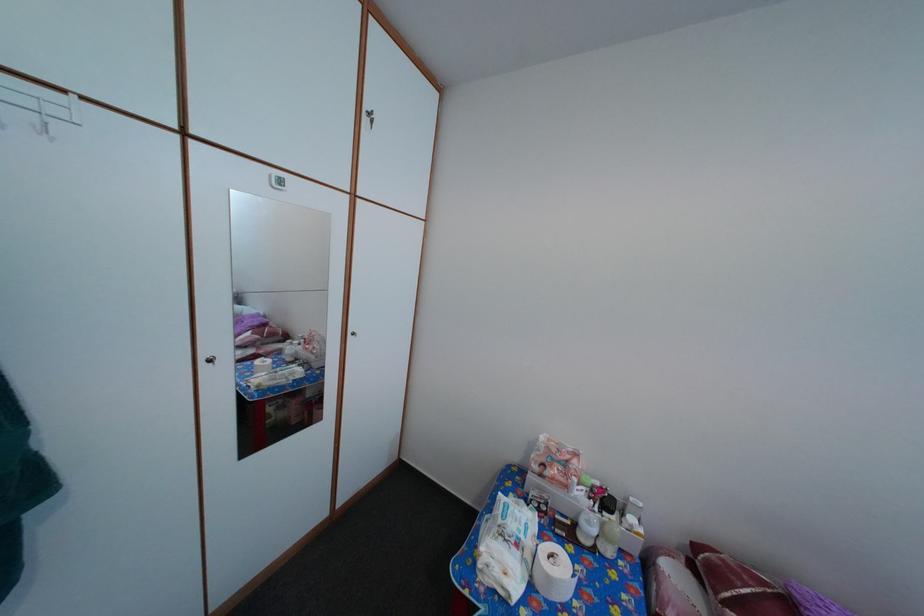
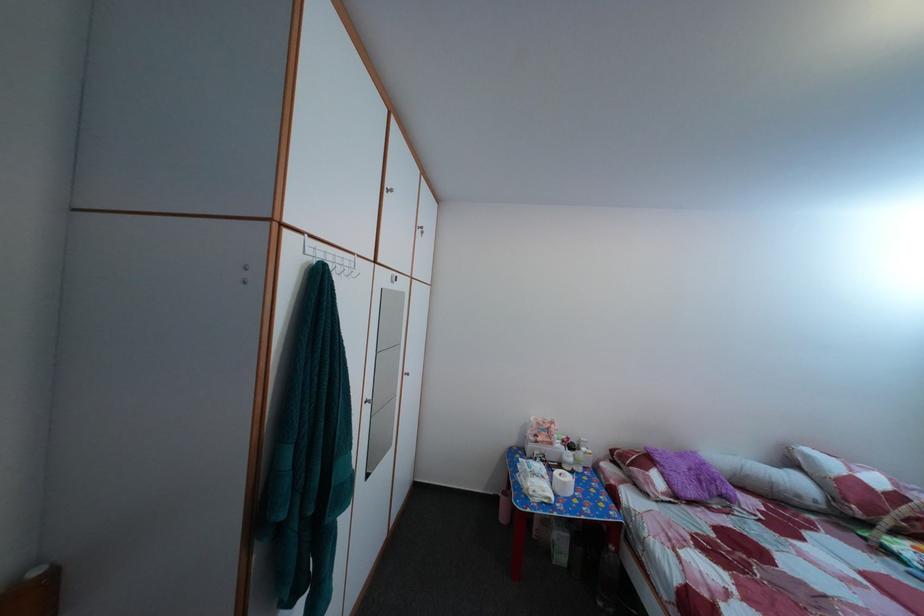
The images are taken continuously from a first-person perspective. In which direction are you moving?

The cameraman moved toward left, backward.